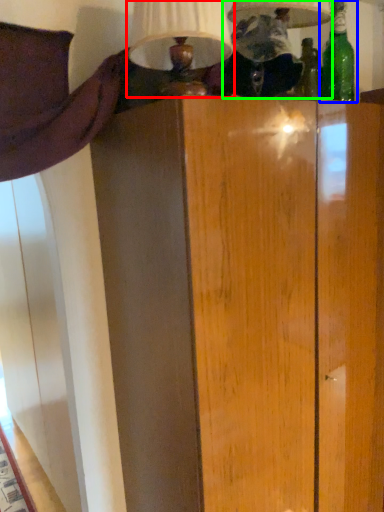
Question: Based on their relative distances, which object is nearer to table lamp (highlighted by a red box)? Choose from bottle (highlighted by a blue box) and table lamp (highlighted by a green box).

Choices:
 (A) bottle
 (B) table lamp

Answer: (B)